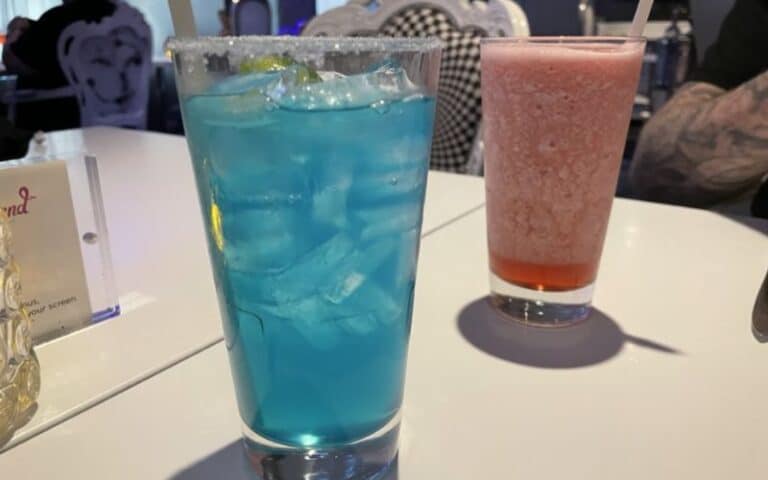
This screenshot has width=768, height=480. I want to click on white tabletop, so click(524, 422).